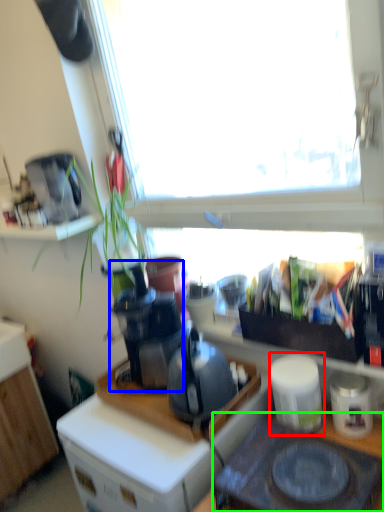
Question: Which is farther away from appliance (highlighted by a red box)? coffee machine (highlighted by a blue box) or gas stove (highlighted by a green box)?

Choices:
 (A) coffee machine
 (B) gas stove

Answer: (A)